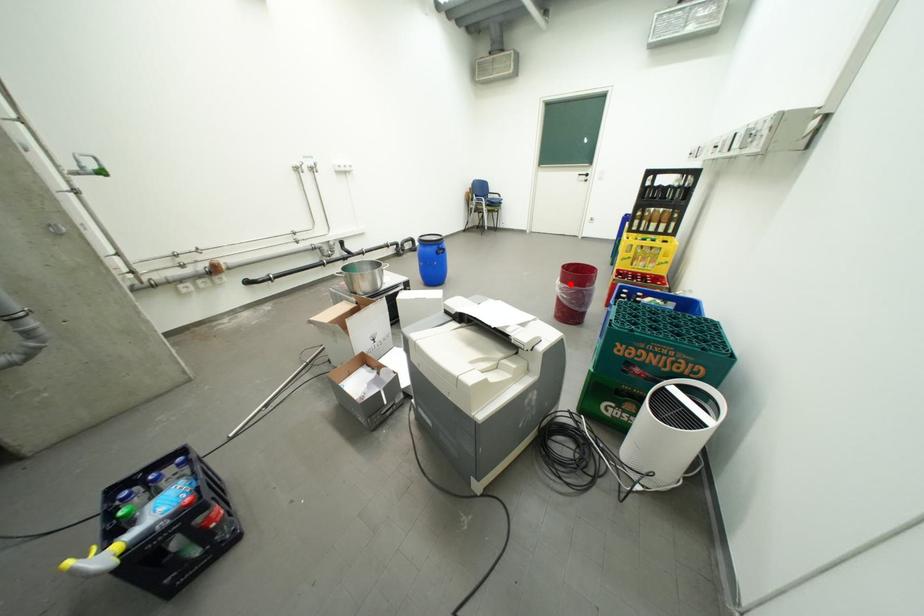
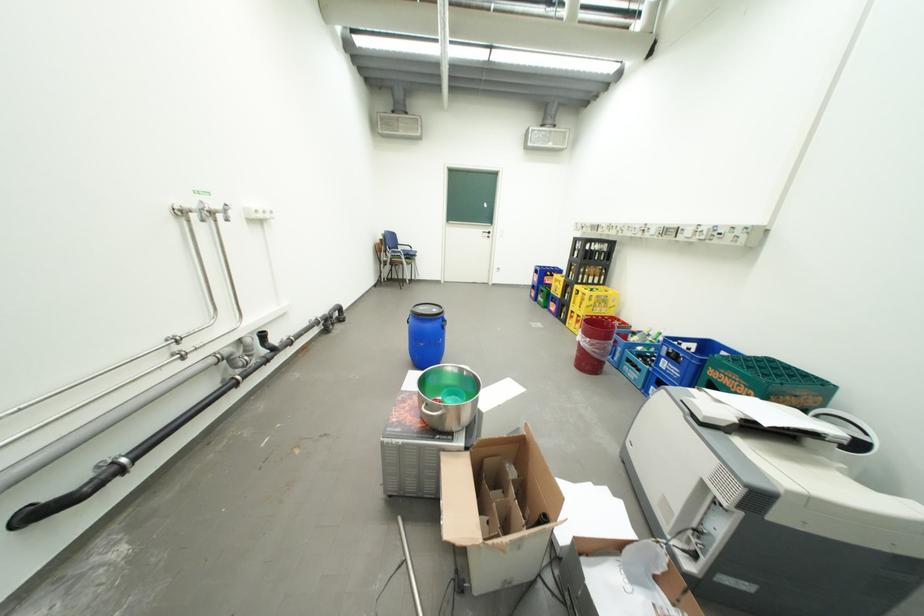
Question: I am providing you with two images of the same scene from different viewpoints. A red point is shown in image1. For the corresponding object point in image2, is it positioned nearer or farther from the camera?

Choices:
 (A) Nearer
 (B) Farther

Answer: (A)